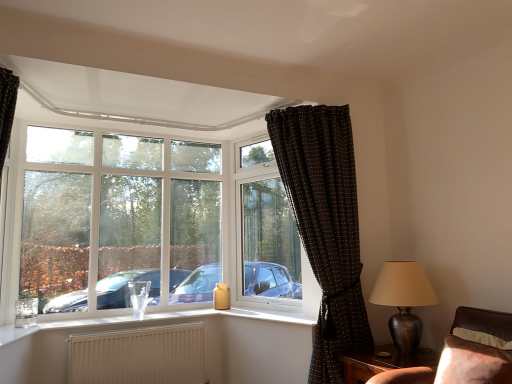
Question: Is white textured radiator at lower center facing towards brown leather couch at lower right?

Choices:
 (A) yes
 (B) no

Answer: (A)

Question: Is white textured radiator at lower center bigger than brown leather couch at lower right?

Choices:
 (A) no
 (B) yes

Answer: (B)

Question: Is white textured radiator at lower center taller than brown leather couch at lower right?

Choices:
 (A) no
 (B) yes

Answer: (B)

Question: Is white textured radiator at lower center looking in the opposite direction of brown leather couch at lower right?

Choices:
 (A) no
 (B) yes

Answer: (A)

Question: From a real-world perspective, is white textured radiator at lower center under brown leather couch at lower right?

Choices:
 (A) yes
 (B) no

Answer: (A)

Question: From a real-world perspective, relative to white plastic vase at lower center, is brown dotted fabric curtain at upper right, which is the second curtain from left to right, vertically above or below?

Choices:
 (A) below
 (B) above

Answer: (B)

Question: Looking at their shapes, would you say brown dotted fabric curtain at upper right, which is the 1th curtain from right to left, is wider or thinner than white plastic vase at lower center?

Choices:
 (A) wide
 (B) thin

Answer: (A)

Question: From the image's perspective, relative to white plastic vase at lower center, is brown dotted fabric curtain at upper right, which is the second curtain from left to right, above or below?

Choices:
 (A) below
 (B) above

Answer: (B)

Question: Is brown dotted fabric curtain at upper right, which is the 1th curtain from right to left, to the left or to the right of white plastic vase at lower center in the image?

Choices:
 (A) right
 (B) left

Answer: (A)

Question: From a real-world perspective, is white plastic vase at lower center positioned above or below brown wooden table at lower right?

Choices:
 (A) below
 (B) above

Answer: (B)

Question: Considering the positions of white plastic vase at lower center and brown wooden table at lower right in the image, is white plastic vase at lower center wider or thinner than brown wooden table at lower right?

Choices:
 (A) thin
 (B) wide

Answer: (A)

Question: Considering the positions of white plastic vase at lower center and brown wooden table at lower right in the image, is white plastic vase at lower center taller or shorter than brown wooden table at lower right?

Choices:
 (A) short
 (B) tall

Answer: (A)

Question: In the image, is white plastic vase at lower center on the left side or the right side of brown wooden table at lower right?

Choices:
 (A) left
 (B) right

Answer: (A)

Question: From their relative heights in the image, would you say white plastic window at upper left is taller or shorter than white plastic vase at lower center?

Choices:
 (A) short
 (B) tall

Answer: (B)

Question: Visually, is white plastic window at upper left positioned to the left or to the right of white plastic vase at lower center?

Choices:
 (A) left
 (B) right

Answer: (A)